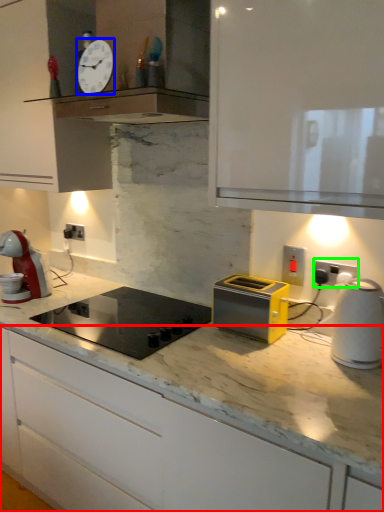
Question: Estimate the real-world distances between objects in this image. Which object is farther from cabinetry (highlighted by a red box), clock (highlighted by a blue box) or electric outlet (highlighted by a green box)?

Choices:
 (A) clock
 (B) electric outlet

Answer: (A)